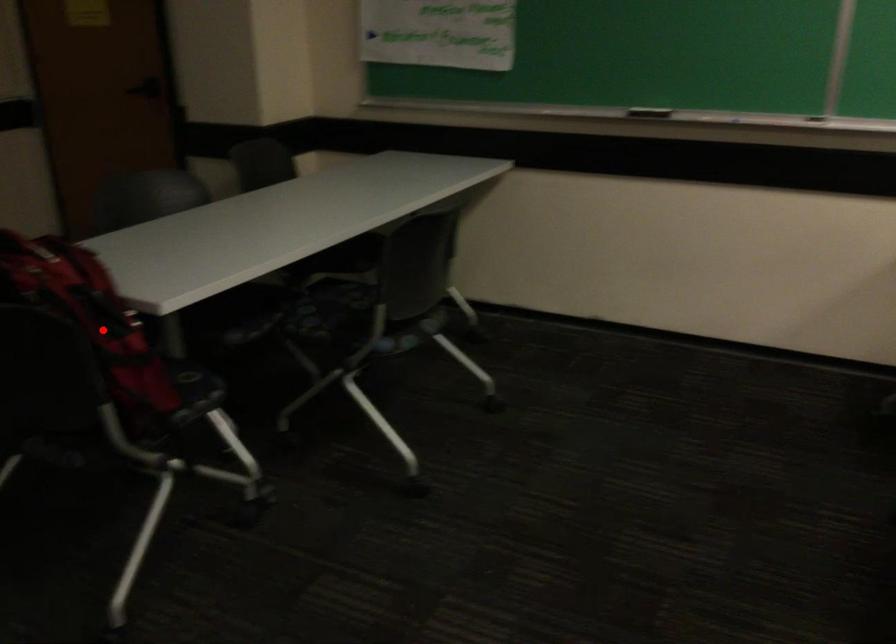
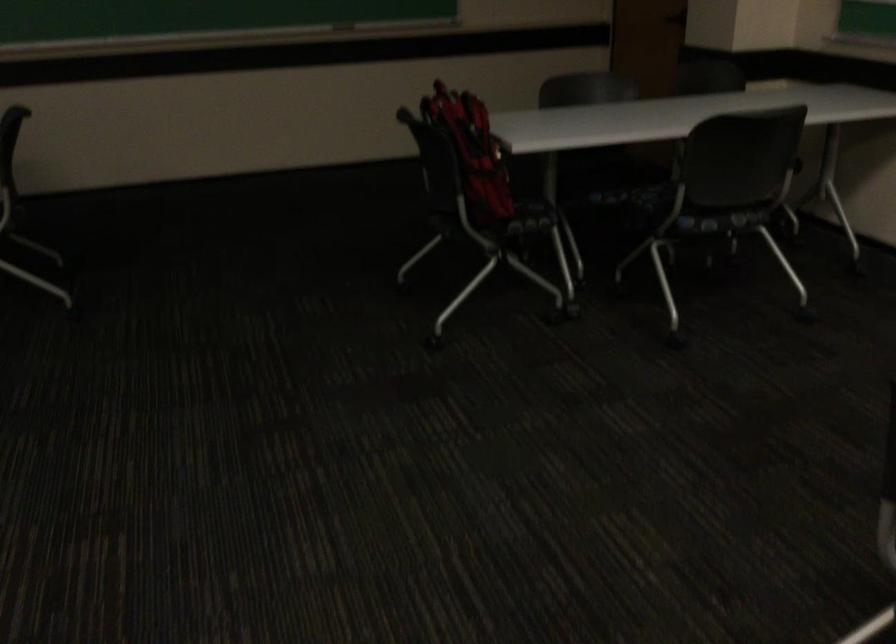
Question: I am providing you with two images of the same scene from different viewpoints. Given a red point in image1, look at the same physical point in image2. Is it:

Choices:
 (A) Closer to the viewpoint
 (B) Farther from the viewpoint

Answer: (B)